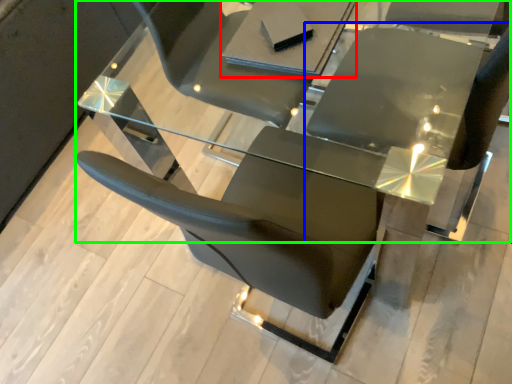
Question: Which object is the farthest from table (highlighted by a red box)? Choose among these: chair (highlighted by a blue box) or table (highlighted by a green box).

Choices:
 (A) chair
 (B) table

Answer: (A)